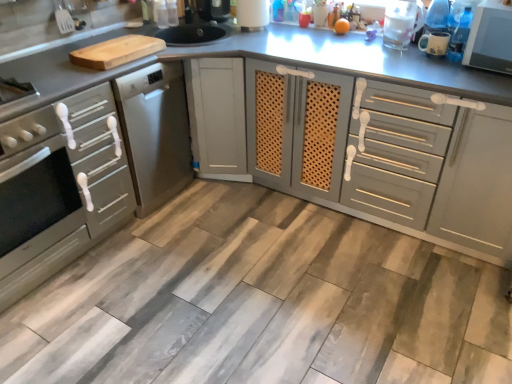
Image resolution: width=512 pixels, height=384 pixels. In order to click on vacant space positioned to the left of transparent plastic pitcher at upper right, the 2th appliance viewed from the back in this screenshot , I will do `click(358, 49)`.